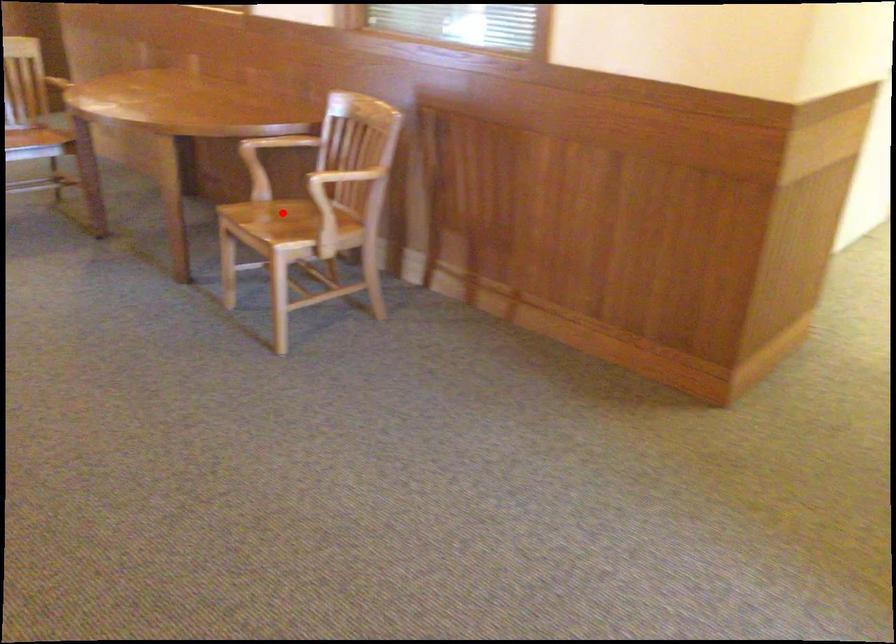
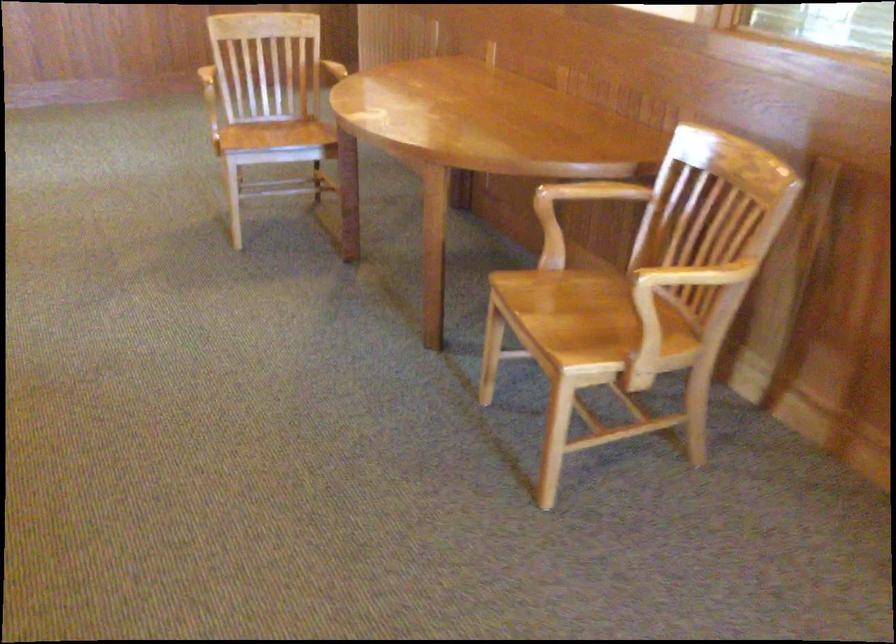
Where in the second image is the point corresponding to the highlighted location from the first image?

(583, 301)